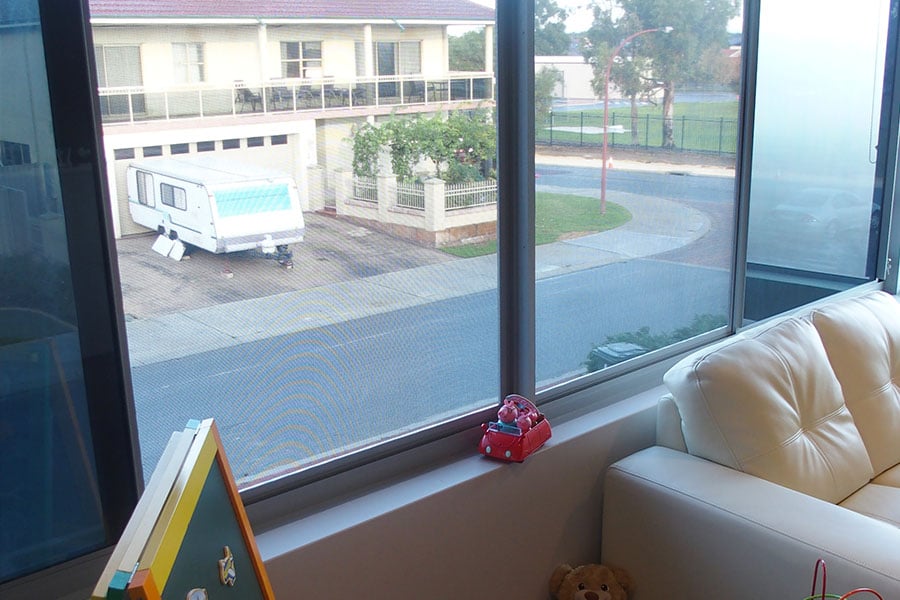
Find the location of `chairs`. chairs is located at coordinates (416, 89), (356, 92), (333, 90), (307, 94), (284, 94), (253, 96).